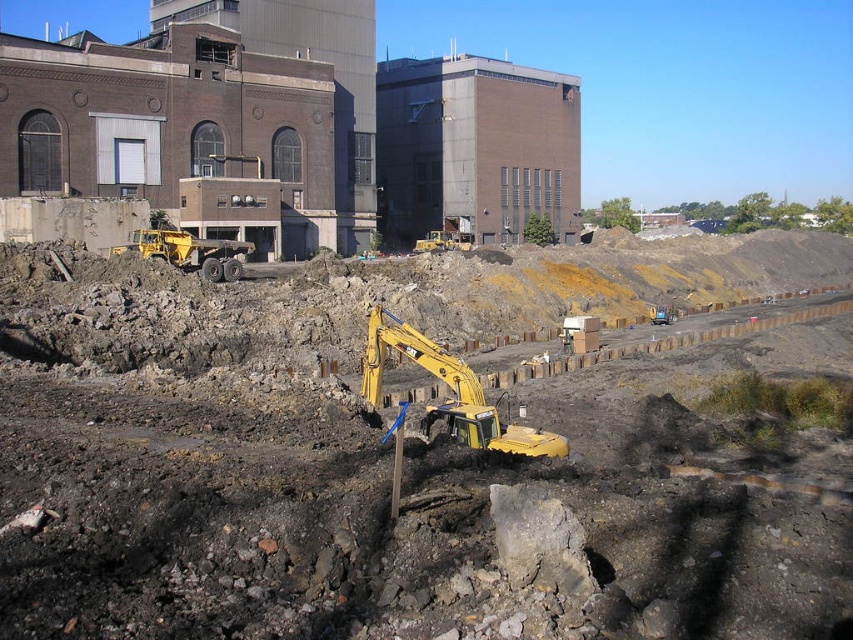
You are an inspector at a construction site. You need to determine which of the two yellow metallic excavators is taller. The yellow metallic excavator at center and the yellow metallic excavator at left are both in your view. Based on the scene, which one is taller?

The yellow metallic excavator at center is taller than the yellow metallic excavator at left according to the description.